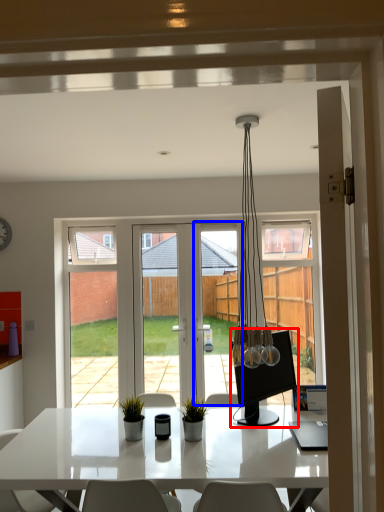
Question: Among these objects, which one is nearest to the camera, computer monitor (highlighted by a red box) or screen door (highlighted by a blue box)?

Choices:
 (A) computer monitor
 (B) screen door

Answer: (A)